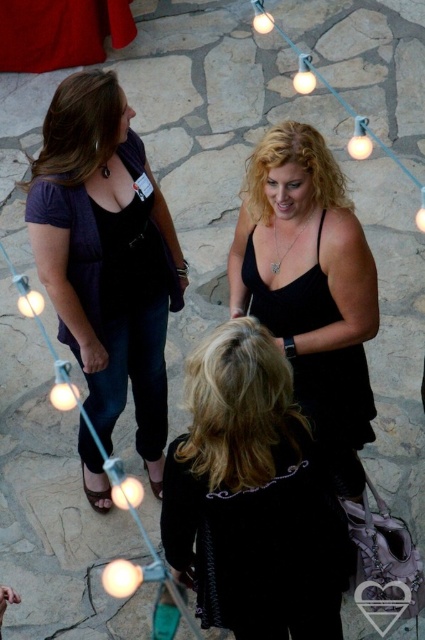
You are standing at the edge of the gathering and want to hand a drink to both the person wearing the black velvet jacket at lower center and the person wearing the matte purple blouse at left. Which one should you approach first to ensure you can reach them without walking past the other?

You should approach the black velvet jacket at lower center first because it is closer to you than the matte purple blouse at left, so you can reach them without needing to walk past the other person.

You are organizing a charity event and need to decide which outfit to choose between the black velvet jacket at lower center and the black satin dress at center for a compact display space. Which one would you choose and why?

You should choose the black velvet jacket at lower center because its width is less than the black satin dress at center, making it more suitable for a compact display space.